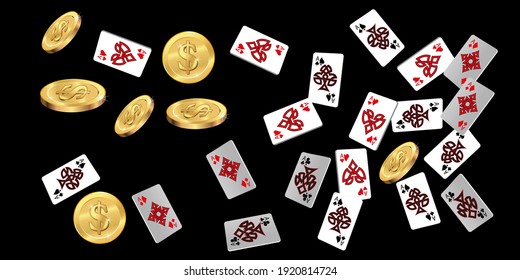
This screenshot has height=280, width=520. In order to click on playing cards with hearts in this screenshot , I will do `click(119, 49)`, `click(262, 50)`, `click(431, 61)`, `click(372, 118)`, `click(291, 119)`.